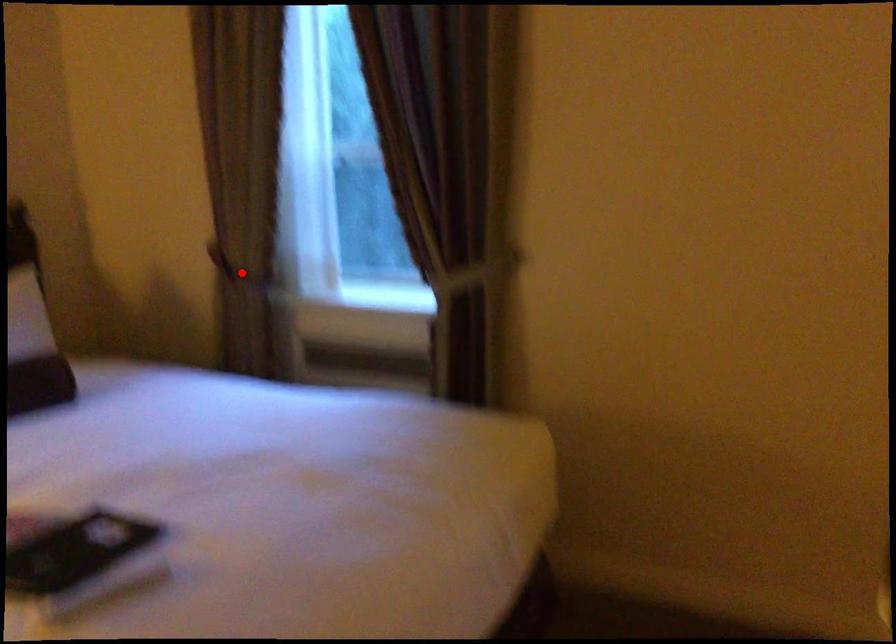
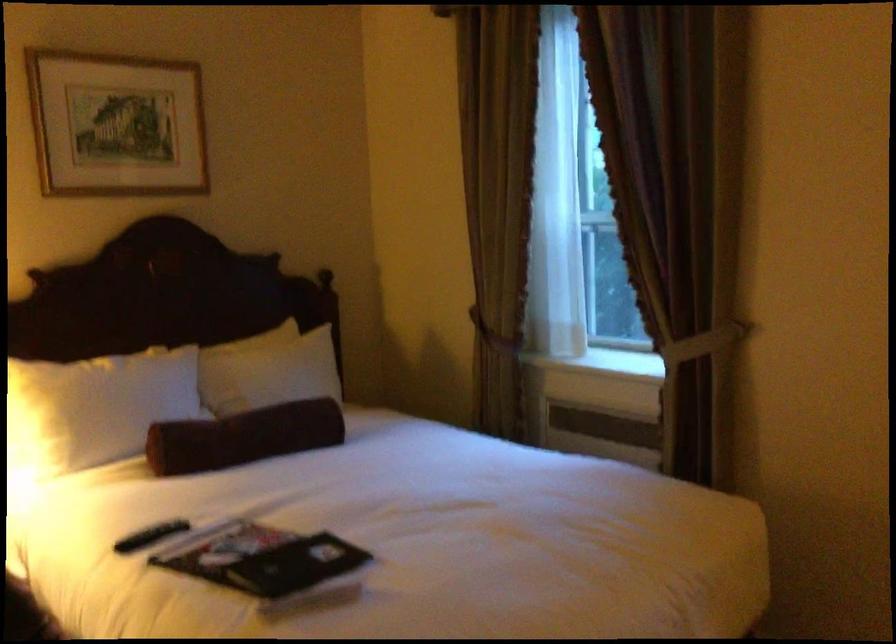
Find the pixel in the second image that matches the highlighted location in the first image.

(494, 334)